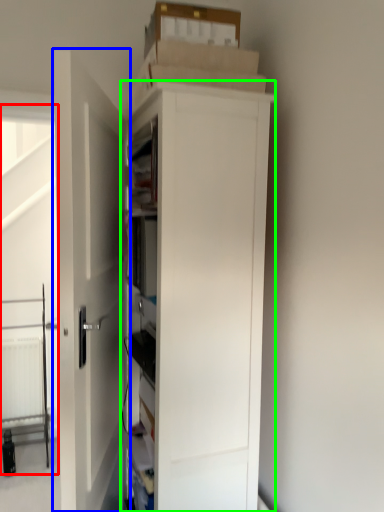
Question: Based on their relative distances, which object is farther from screen door (highlighted by a red box)? Choose from door (highlighted by a blue box) and cupboard (highlighted by a green box).

Choices:
 (A) door
 (B) cupboard

Answer: (B)